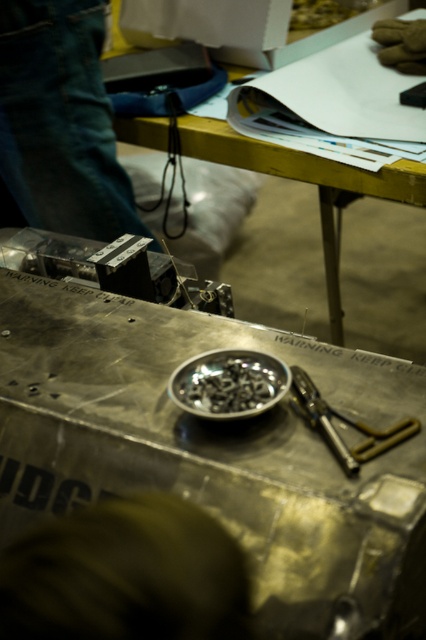
Who is more distant from viewer, (x=20, y=544) or (x=244, y=374)?

The point (x=244, y=374) is more distant.

Does point (37, 611) lie behind point (239, 401)?

No, it is in front of (239, 401).

In order to click on brown fuzzy hair at lower center in this screenshot , I will do `click(126, 576)`.

Which is more to the right, jeans at upper left or metallic silver pliers at center?

metallic silver pliers at center

Is jeans at upper left smaller than metallic silver pliers at center?

Incorrect, jeans at upper left is not smaller in size than metallic silver pliers at center.

Where is `jeans at upper left`? The image size is (426, 640). jeans at upper left is located at coordinates (60, 120).

Locate an element on the screen. jeans at upper left is located at coordinates (60, 120).

The height and width of the screenshot is (640, 426). I want to click on metallic yellow table at upper center, so click(324, 212).

Does metallic yellow table at upper center appear over metallic silver screws at center?

Indeed, metallic yellow table at upper center is positioned over metallic silver screws at center.

Is point (408, 301) farther from viewer compared to point (282, 376)?

Yes.

Image resolution: width=426 pixels, height=640 pixels. Identify the location of metallic yellow table at upper center. (324, 212).